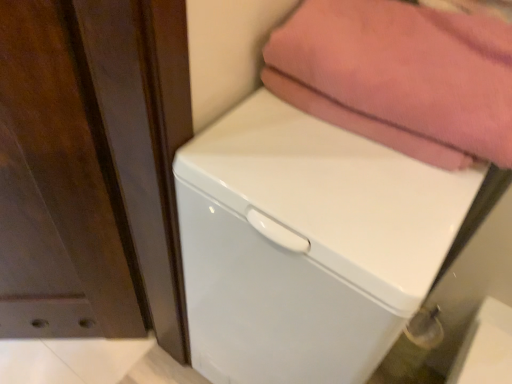
The width and height of the screenshot is (512, 384). I want to click on vacant space in front of pink cotton towel at upper right, so click(360, 203).